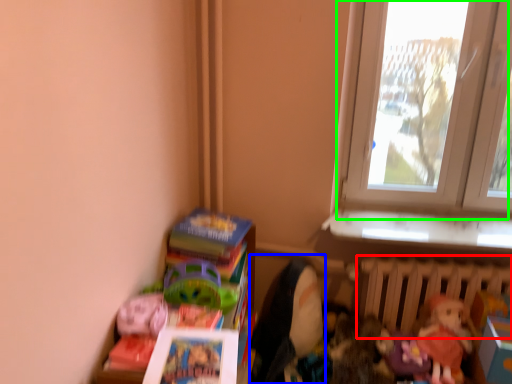
Question: Which object is positioned closest to radiator (highlighted by a red box)? Select from doll (highlighted by a blue box) and window (highlighted by a green box).

Choices:
 (A) doll
 (B) window

Answer: (A)